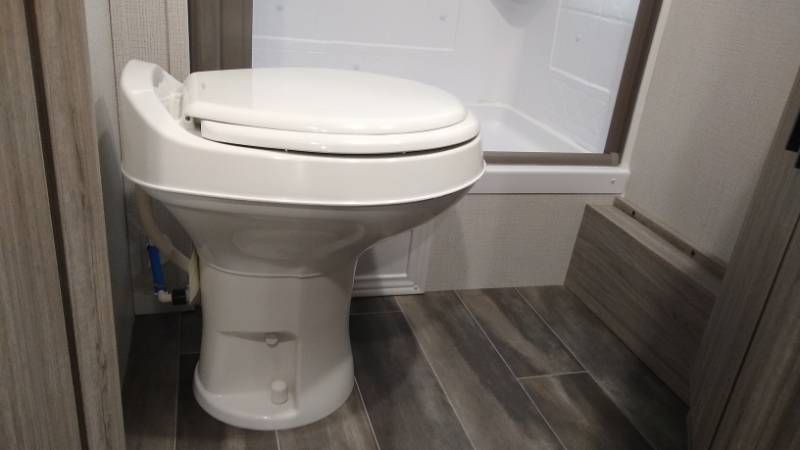
The image size is (800, 450). I want to click on handle, so click(x=158, y=275).